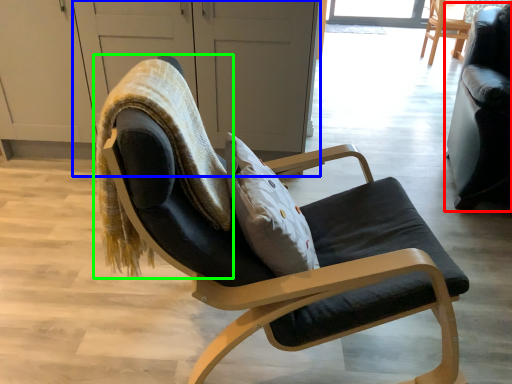
Question: Which object is the farthest from chair (highlighted by a red box)? Choose among these: screen door (highlighted by a blue box) or bean bag chair (highlighted by a green box).

Choices:
 (A) screen door
 (B) bean bag chair

Answer: (B)